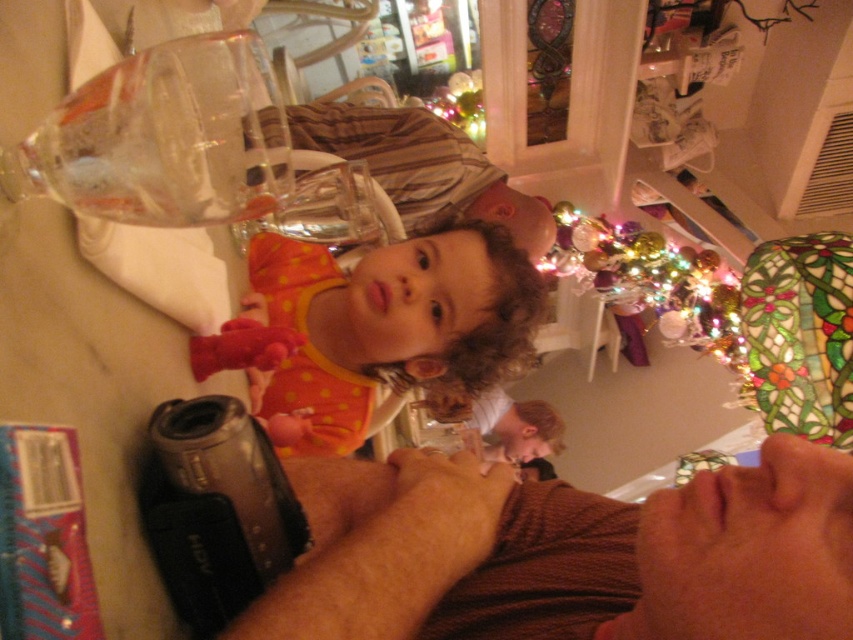
Who is lower down, striped cotton shirt at upper center or iridescent glass ornament at upper right?

iridescent glass ornament at upper right is below.

Can you confirm if striped cotton shirt at upper center is positioned to the left of iridescent glass ornament at upper right?

Indeed, striped cotton shirt at upper center is positioned on the left side of iridescent glass ornament at upper right.

Is point (440, 218) less distant than point (674, 324)?

Yes, point (440, 218) is closer to viewer.

At what (x,y) coordinates should I click in order to perform the action: click on striped cotton shirt at upper center. Please return your answer as a coordinate pair (x, y). This screenshot has height=640, width=853. Looking at the image, I should click on (422, 168).

Can you confirm if orange polka dot dress at center is positioned to the right of striped cotton shirt at upper center?

In fact, orange polka dot dress at center is to the left of striped cotton shirt at upper center.

Between orange polka dot dress at center and striped cotton shirt at upper center, which one is positioned lower?

orange polka dot dress at center

Measure the distance between orange polka dot dress at center and camera.

orange polka dot dress at center and camera are 32.01 inches apart.

What are the coordinates of `orange polka dot dress at center` in the screenshot? It's located at (387, 328).

The image size is (853, 640). What do you see at coordinates (584, 557) in the screenshot?
I see `brown knit sweater at center` at bounding box center [584, 557].

Does point (796, 637) come farther from viewer compared to point (421, 184)?

No, (796, 637) is closer to viewer.

Which is behind, point (616, 636) or point (427, 180)?

The point (427, 180) is more distant.

The width and height of the screenshot is (853, 640). I want to click on brown knit sweater at center, so click(584, 557).